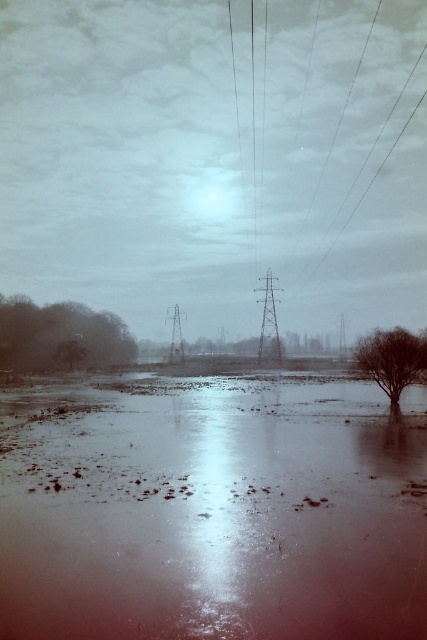
Can you confirm if shiny reflective water at center is thinner than bare brown tree at right?

In fact, shiny reflective water at center might be wider than bare brown tree at right.

Is the position of shiny reflective water at center more distant than that of bare brown tree at right?

No, shiny reflective water at center is closer to the viewer.

Is point (9, 516) positioned after point (366, 362)?

No, it is not.

Find the location of a particular element. shiny reflective water at center is located at coordinates (213, 512).

Between green matte tree at lower left and bare brown tree at right, which one is positioned lower?

bare brown tree at right is lower down.

Between green matte tree at lower left and bare brown tree at right, which one is positioned higher?

green matte tree at lower left is above.

Locate an element on the screen. The image size is (427, 640). green matte tree at lower left is located at coordinates coord(60,337).

Identify the location of green matte tree at lower left. The image size is (427, 640). (60, 337).

Does point (43, 445) come behind point (58, 349)?

No, (43, 445) is in front of (58, 349).

Does shiny reflective water at center have a greater height compared to green matte tree at lower left?

Incorrect, shiny reflective water at center's height is not larger of green matte tree at lower left's.

Is point (172, 460) closer to camera compared to point (49, 364)?

Yes, point (172, 460) is closer to viewer.

Find the location of a particular element. This screenshot has width=427, height=640. shiny reflective water at center is located at coordinates (x=213, y=512).